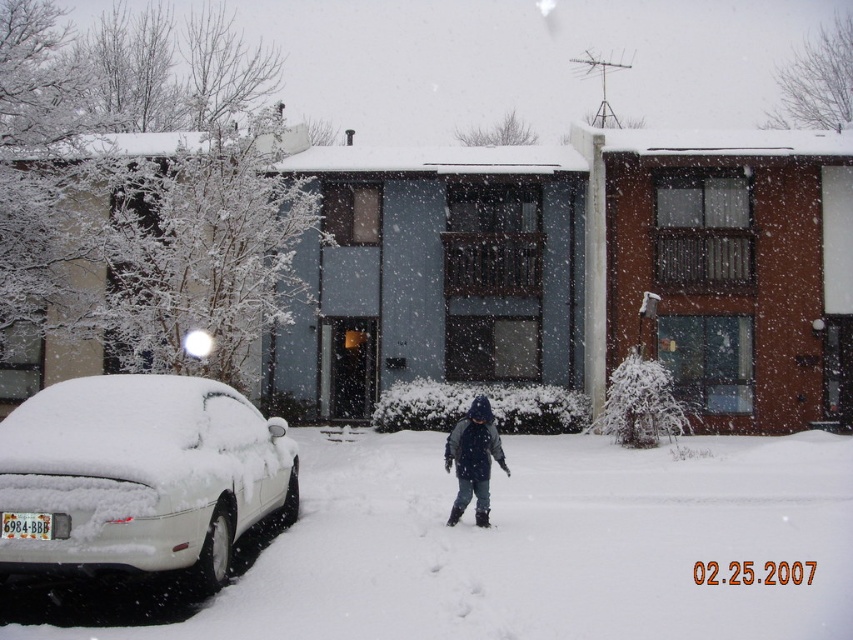
Question: Which of the following is the closest to the observer?

Choices:
 (A) (82, 384)
 (B) (486, 502)

Answer: (A)

Question: Observing the image, what is the correct spatial positioning of white matte car at left in reference to dark blue knit hat at center?

Choices:
 (A) below
 (B) above

Answer: (B)

Question: Is white matte car at left thinner than dark blue knit hat at center?

Choices:
 (A) yes
 (B) no

Answer: (B)

Question: Which point is closer to the camera?

Choices:
 (A) white matte car at left
 (B) dark blue knit hat at center

Answer: (A)

Question: Is white matte car at left in front of dark blue knit hat at center?

Choices:
 (A) no
 (B) yes

Answer: (B)